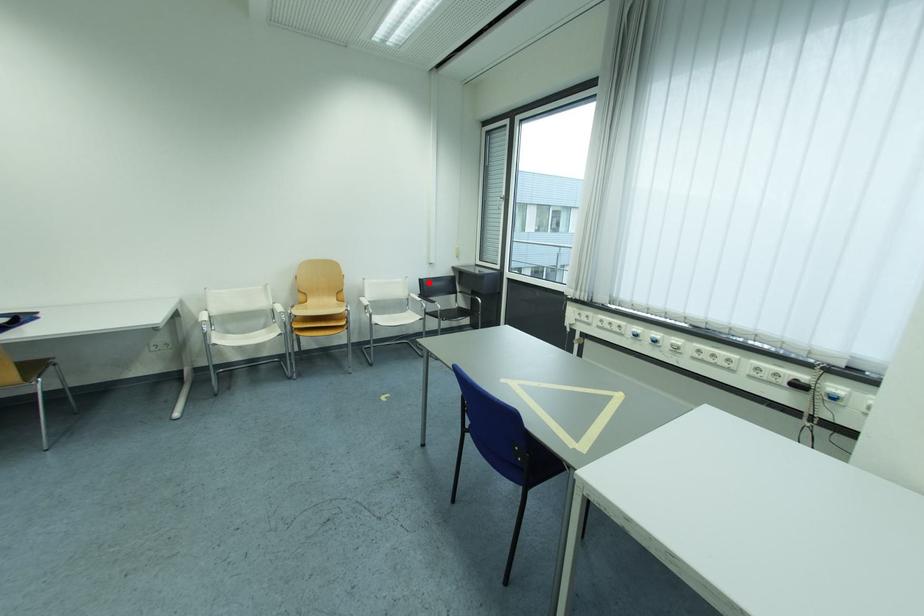
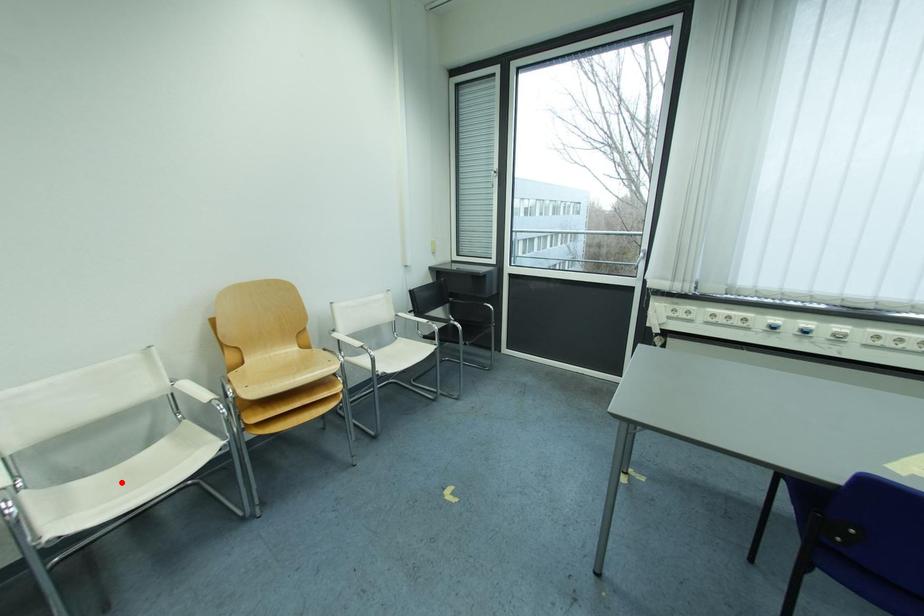
I am providing you with two images of the same scene from different viewpoints. A red point is marked on the first image and another point is marked on the second image. Do the highlighted points in image1 and image2 indicate the same real-world spot?

No